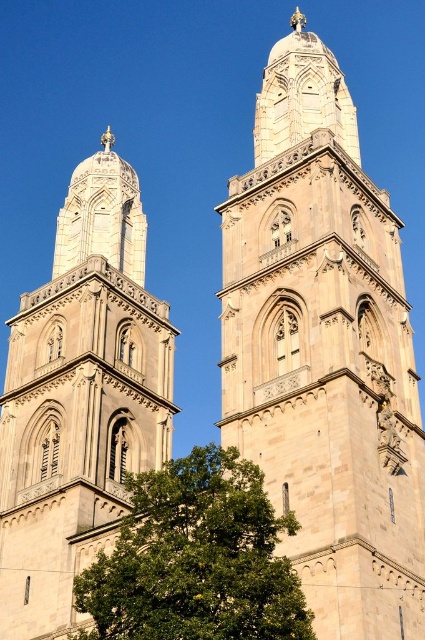
Question: Can you confirm if beige stone tower at center is bigger than beige stone tower at left?

Choices:
 (A) yes
 (B) no

Answer: (A)

Question: Does beige stone tower at center appear on the left side of green leafy tree at lower left?

Choices:
 (A) no
 (B) yes

Answer: (A)

Question: Which of the following is the farthest from the observer?

Choices:
 (A) beige stone tower at center
 (B) green leafy tree at lower left
 (C) beige stone tower at left

Answer: (C)

Question: Is beige stone tower at center behind beige stone tower at left?

Choices:
 (A) no
 (B) yes

Answer: (A)

Question: Among these objects, which one is nearest to the camera?

Choices:
 (A) beige stone tower at left
 (B) green leafy tree at lower left

Answer: (B)

Question: Which point is farther to the camera?

Choices:
 (A) beige stone tower at left
 (B) beige stone tower at center
 (C) green leafy tree at lower left

Answer: (A)